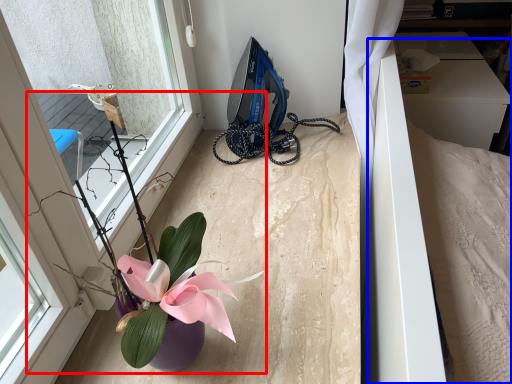
Question: Which point is further to the camera, houseplant (highlighted by a red box) or bed (highlighted by a blue box)?

Choices:
 (A) houseplant
 (B) bed

Answer: (B)